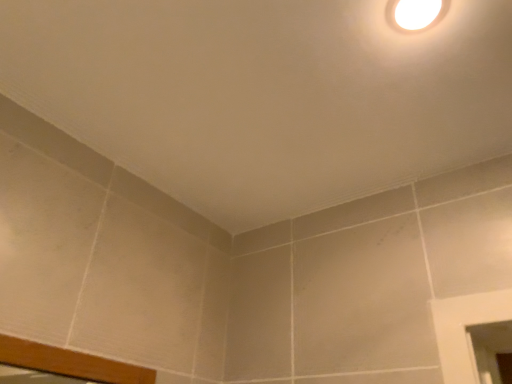
Describe the element at coordinates (415, 14) in the screenshot. The image size is (512, 384). I see `white matte light fixture at upper right` at that location.

Where is `white matte light fixture at upper right`? Image resolution: width=512 pixels, height=384 pixels. white matte light fixture at upper right is located at coordinates (415, 14).

What is the approximate width of white matte light fixture at upper right?

white matte light fixture at upper right is 4.04 inches wide.

I want to click on white matte light fixture at upper right, so (x=415, y=14).